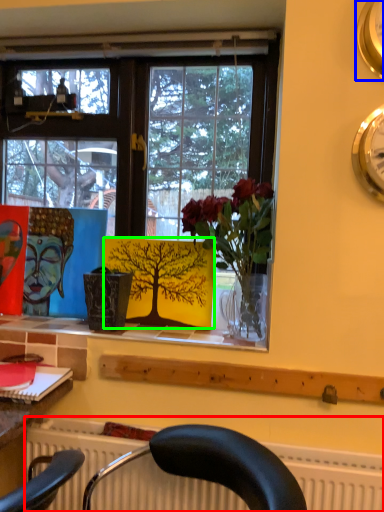
Question: Which object is the farthest from radiator (highlighted by a red box)? Choose among these: clock (highlighted by a blue box) or plant (highlighted by a green box).

Choices:
 (A) clock
 (B) plant

Answer: (A)